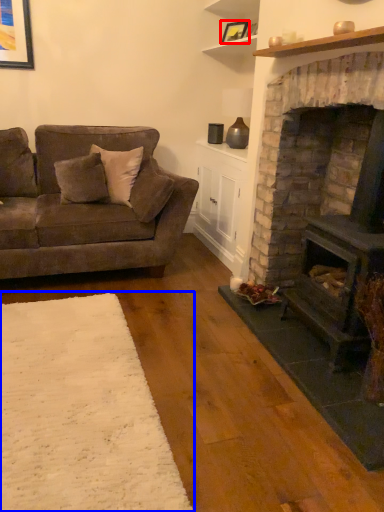
Question: Which object appears closest to the camera in this image, picture frame (highlighted by a red box) or plain (highlighted by a blue box)?

Choices:
 (A) picture frame
 (B) plain

Answer: (B)